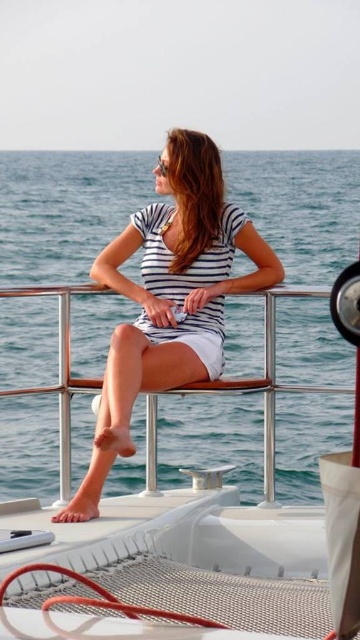
You are a photographer trying to capture the scene of the white matte boat at center and the white striped dress at center. Which object should you focus on first if you want to ensure both are in the frame without moving the camera? Explain your reasoning based on their positions.

The white matte boat at center is positioned under the white striped dress at center. Since the boat is beneath the dress, focusing on the boat first would allow the dress to naturally fall into the frame above it without needing to adjust the camera angle.

You are an observer standing on the deck of the boat. You notice the white matte boat at center and the white striped dress at center. Which object is taller from your viewpoint?

The white striped dress at center is taller than the white matte boat at center.